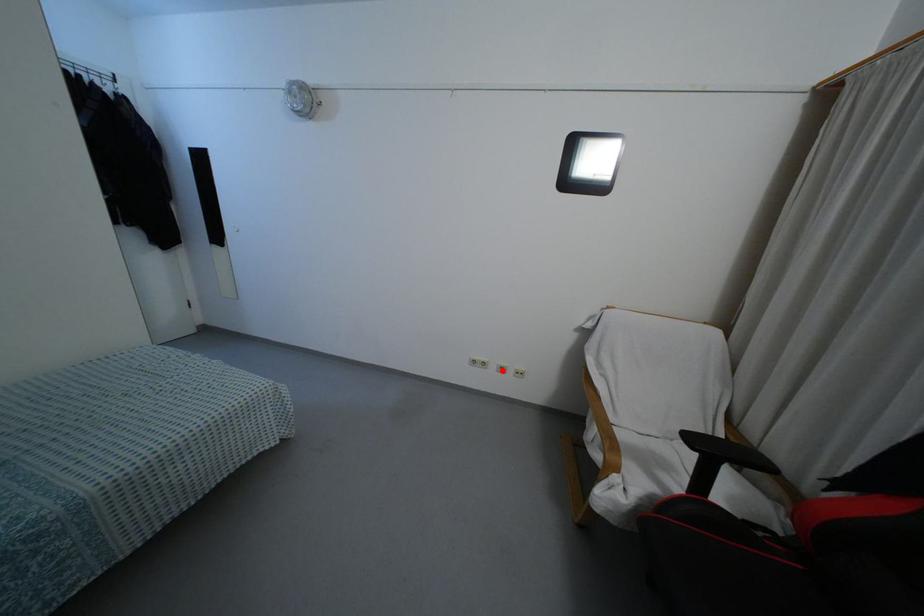
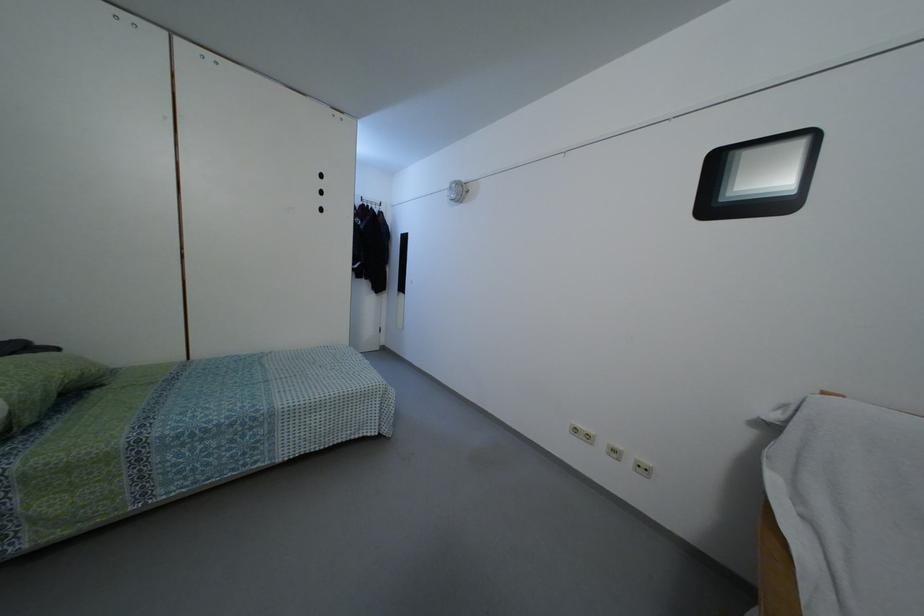
The point at the highlighted location is marked in the first image. Where is the corresponding point in the second image?

(614, 456)